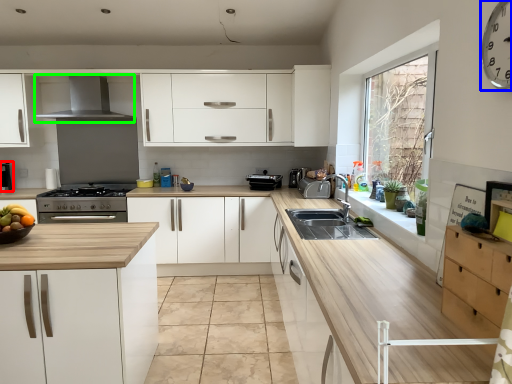
Question: Based on their relative distances, which object is nearer to coffee machine (highlighted by a red box)? Choose from clock (highlighted by a blue box) and exhaust hood (highlighted by a green box).

Choices:
 (A) clock
 (B) exhaust hood

Answer: (B)